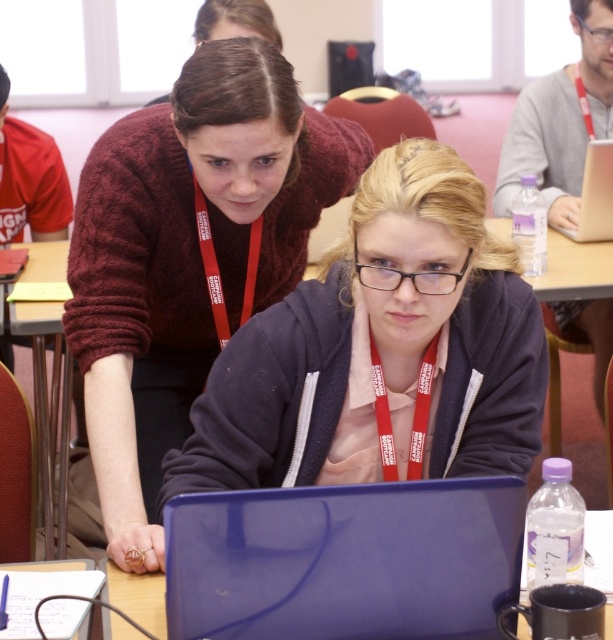
Question: Does glossy plastic laptop at center appear over metallic silver laptop at upper right?

Choices:
 (A) no
 (B) yes

Answer: (A)

Question: From the image, what is the correct spatial relationship of maroon knitted sweater at upper center in relation to glossy plastic laptop at center?

Choices:
 (A) left
 (B) right

Answer: (A)

Question: Which of the following is the closest to the observer?

Choices:
 (A) metallic silver laptop at upper right
 (B) maroon knitted sweater at upper center
 (C) glossy plastic laptop at center

Answer: (C)

Question: From the image, what is the correct spatial relationship of maroon knitted sweater at upper center in relation to metallic silver laptop at upper right?

Choices:
 (A) above
 (B) below

Answer: (B)

Question: Which object is positioned farthest from the metallic silver laptop at upper right?

Choices:
 (A) glossy plastic laptop at center
 (B) maroon knitted sweater at upper center

Answer: (A)

Question: Among these objects, which one is nearest to the camera?

Choices:
 (A) metallic silver laptop at upper right
 (B) glossy plastic laptop at center

Answer: (B)